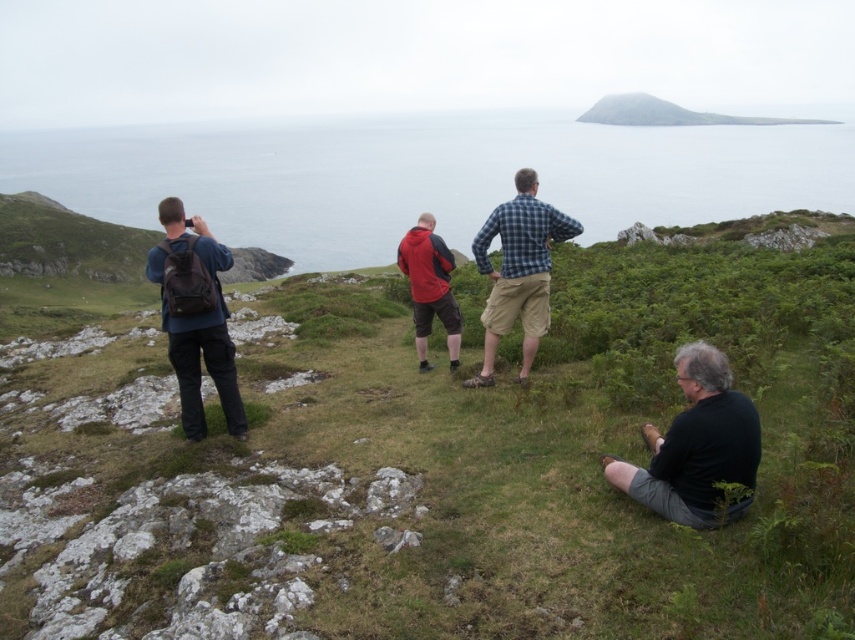
This screenshot has height=640, width=855. I want to click on green grassy at center, so click(x=433, y=460).

Image resolution: width=855 pixels, height=640 pixels. Find the location of `green grassy at center`. green grassy at center is located at coordinates (433, 460).

Is green grassy at center positioned at the back of matte black backpack at left?

No.

Locate an element on the screen. This screenshot has height=640, width=855. green grassy at center is located at coordinates [x=433, y=460].

Is black matte shirt at lower right thinner than matte black backpack at left?

Indeed, black matte shirt at lower right has a lesser width compared to matte black backpack at left.

Is black matte shirt at lower right closer to camera compared to matte black backpack at left?

That is True.

Between point (712, 420) and point (211, 282), which one is positioned behind?

The point (211, 282) is more distant.

Locate an element on the screen. black matte shirt at lower right is located at coordinates (696, 445).